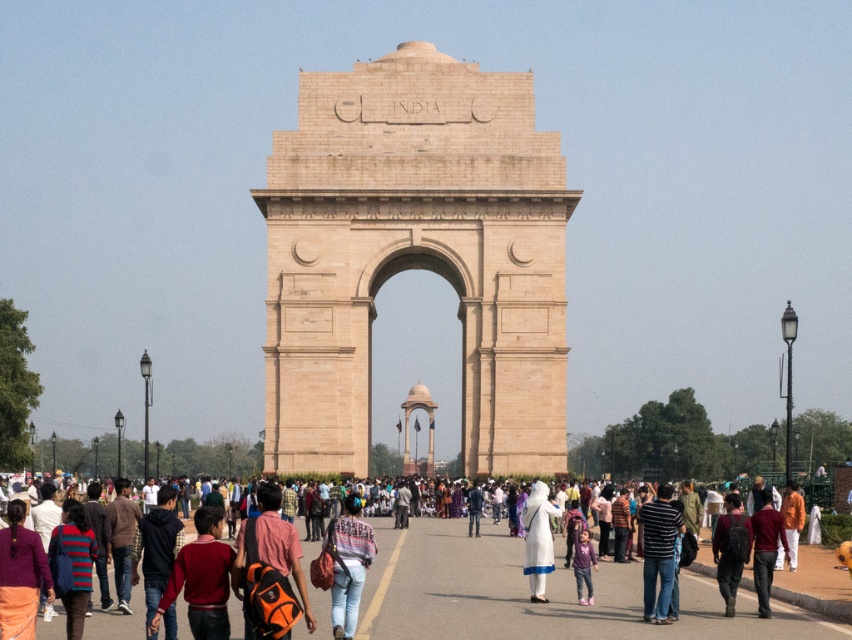
You are a photographer standing at the entrance of India Gate monument. You notice a tourist wearing a white fabric dress at center and carrying a dark brown leather backpack at center. Can you determine which item is smaller in size?

The white fabric dress at center has a smaller size compared to the dark brown leather backpack at center, so the white fabric dress at center is smaller.

Based on the photo, you are a photographer standing in front of the India Gate monument. You want to capture a photo that includes both the beige stone arch at center and the white fabric dress at center. Which object should you focus on first if you want to ensure both are in frame without moving the camera?

You should focus on the beige stone arch at center first because it is taller than the white fabric dress at center, so adjusting the camera angle to include its full height will naturally include the shorter dress in the frame.

You are a photographer standing at the entrance of India Gate monument. You notice a tourist wearing a white fabric dress at center and another carrying a dark brown leather backpack at center. Which object is closer to the camera based on their height?

The white fabric dress at center is shorter than the dark brown leather backpack at center, so the dark brown leather backpack at center is closer to the camera.